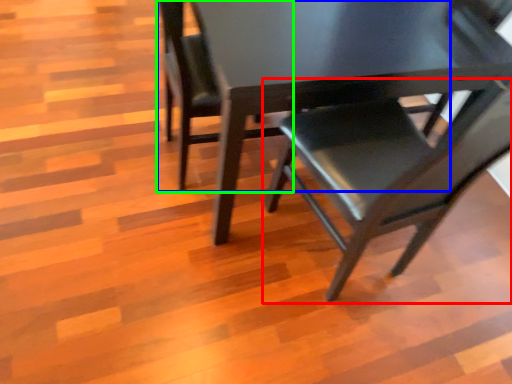
Question: Which is nearer to the chair (highlighted by a red box)? chair (highlighted by a blue box) or chair (highlighted by a green box).

Choices:
 (A) chair
 (B) chair

Answer: (B)